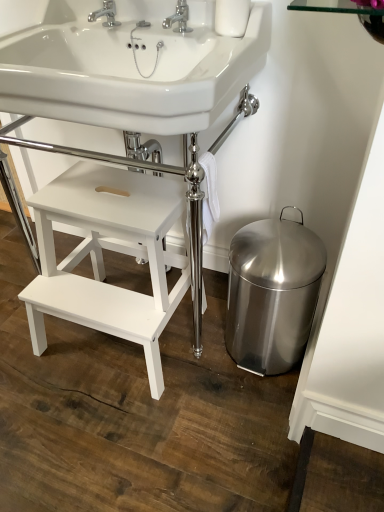
Question: From a real-world perspective, is stainless steel bidet at lower right positioned above or below chrome metallic faucet at upper center, acting as the second tap starting from the left?

Choices:
 (A) above
 (B) below

Answer: (B)

Question: From the image's perspective, is stainless steel bidet at lower right above or below chrome metallic faucet at upper center, acting as the second tap starting from the left?

Choices:
 (A) below
 (B) above

Answer: (A)

Question: Based on their relative distances, which object is nearer to the silver metallic faucet at upper center, arranged as the 2th tap when viewed from the right?

Choices:
 (A) white glossy sink at upper center, positioned as the 1th sink in bottom-to-top order
 (B) chrome metallic faucet at upper center, acting as the second tap starting from the left
 (C) white matte stool at lower left
 (D) white glossy sink at upper center, the 2th sink positioned from the bottom
 (E) stainless steel bidet at lower right

Answer: (B)

Question: Which object is positioned closest to the stainless steel bidet at lower right?

Choices:
 (A) silver metallic faucet at upper center, arranged as the 2th tap when viewed from the right
 (B) white glossy sink at upper center, which is counted as the 1th sink, starting from the top
 (C) chrome metallic faucet at upper center, acting as the second tap starting from the left
 (D) white glossy sink at upper center, positioned as the 1th sink in bottom-to-top order
 (E) white matte stool at lower left

Answer: (E)